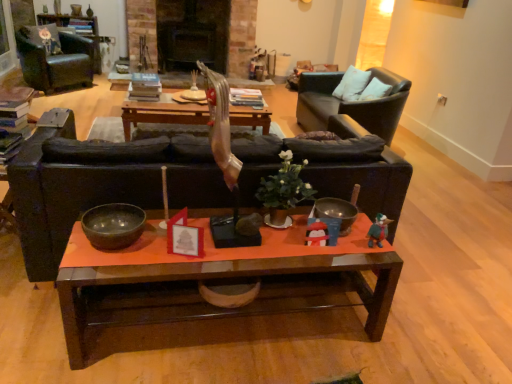
This screenshot has width=512, height=384. What do you see at coordinates (56, 63) in the screenshot?
I see `leather armchair at left, which ranks as the second chair in right-to-left order` at bounding box center [56, 63].

The image size is (512, 384). Describe the element at coordinates (284, 189) in the screenshot. I see `green matte plant at center` at that location.

Locate an element on the screen. shiny dark wood bowl at center, which ranks as the 1th bowl in front-to-back order is located at coordinates (113, 225).

This screenshot has height=384, width=512. I want to click on matte black couch at center, so click(x=100, y=186).

Based on the photo, is wooden coffee table at center, the 2th coffee table from the bottom, wider or thinner than velvet floral pillow at upper left, the first pillow positioned from the top?

wooden coffee table at center, the 2th coffee table from the bottom, is wider than velvet floral pillow at upper left, the first pillow positioned from the top.

From the image's perspective, which object appears higher, wooden coffee table at center, which is the 1th coffee table in top-to-bottom order, or velvet floral pillow at upper left, the 1th pillow viewed from the back?

From the image's view, velvet floral pillow at upper left, the 1th pillow viewed from the back, is above.

Is wooden coffee table at center, the 2th coffee table from the bottom, surrounding velvet floral pillow at upper left, which is the 2th pillow in front-to-back order?

Definitely not — velvet floral pillow at upper left, which is the 2th pillow in front-to-back order, is not inside wooden coffee table at center, the 2th coffee table from the bottom.

Is shiny brown wooden coffee table at center, which appears as the first coffee table when viewed from the front, positioned in front of black leather chair at upper right, which is the second chair from left to right?

That is True.

Can you tell me how much shiny brown wooden coffee table at center, which appears as the 2th coffee table when viewed from the back, and black leather chair at upper right, which is the second chair from left to right, differ in facing direction?

The angular difference between shiny brown wooden coffee table at center, which appears as the 2th coffee table when viewed from the back, and black leather chair at upper right, which is the second chair from left to right, is 90.6 degrees.

Is shiny brown wooden coffee table at center, which is counted as the second coffee table, starting from the top, taller or shorter than black leather chair at upper right, which is the second chair from left to right?

In the image, shiny brown wooden coffee table at center, which is counted as the second coffee table, starting from the top, appears to be shorter than black leather chair at upper right, which is the second chair from left to right.

From the image's perspective, which chair is the 1st one above the shiny brown wooden coffee table at center, which is counted as the second coffee table, starting from the top? Please provide its 2D coordinates.

[(351, 103)]

Considering the sizes of green matte plant at center and wooden coffee table at center, which ranks as the 1th coffee table in back-to-front order, in the image, is green matte plant at center bigger or smaller than wooden coffee table at center, which ranks as the 1th coffee table in back-to-front order,?

green matte plant at center is smaller than wooden coffee table at center, which ranks as the 1th coffee table in back-to-front order.

Is green matte plant at center oriented towards wooden coffee table at center, the 2th coffee table from the bottom?

No, green matte plant at center is not oriented towards wooden coffee table at center, the 2th coffee table from the bottom.

Can you confirm if green matte plant at center is taller than wooden coffee table at center, which is the second coffee table from front to back?

In fact, green matte plant at center may be shorter than wooden coffee table at center, which is the second coffee table from front to back.

From a real-world perspective, between white soft pillow at upper right, the 2th pillow viewed from the left, and shiny dark wood bowl at center, which ranks as the 1th bowl in front-to-back order, who is vertically lower?

From a 3D spatial view, shiny dark wood bowl at center, which ranks as the 1th bowl in front-to-back order, is below.

Is white soft pillow at upper right, the 2th pillow viewed from the top, directly adjacent to shiny dark wood bowl at center, marked as the first bowl in a left-to-right arrangement?

No, white soft pillow at upper right, the 2th pillow viewed from the top, is not beside shiny dark wood bowl at center, marked as the first bowl in a left-to-right arrangement.

From the picture: Is white soft pillow at upper right, the 2th pillow viewed from the top, wider or thinner than shiny dark wood bowl at center, which ranks as the 1th bowl in front-to-back order?

Clearly, white soft pillow at upper right, the 2th pillow viewed from the top, has less width compared to shiny dark wood bowl at center, which ranks as the 1th bowl in front-to-back order.

From a real-world perspective, which bowl is the 1st one underneath the white soft pillow at upper right, which is the second pillow in back-to-front order? Please provide its 2D coordinates.

[(113, 225)]

Are white soft pillow at upper right, marked as the 1th pillow in a bottom-to-top arrangement, and velvet floral pillow at upper left, which ranks as the 2th pillow in bottom-to-top order, beside each other?

white soft pillow at upper right, marked as the 1th pillow in a bottom-to-top arrangement, and velvet floral pillow at upper left, which ranks as the 2th pillow in bottom-to-top order, are clearly separated.

Is white soft pillow at upper right, which is the second pillow in back-to-front order, looking in the opposite direction of velvet floral pillow at upper left, the 1th pillow viewed from the back?

That's not correct — white soft pillow at upper right, which is the second pillow in back-to-front order, is not looking away from velvet floral pillow at upper left, the 1th pillow viewed from the back.

Which of these two, white soft pillow at upper right, which is the second pillow in back-to-front order, or velvet floral pillow at upper left, the 1th pillow viewed from the back, is bigger?

velvet floral pillow at upper left, the 1th pillow viewed from the back, is bigger.

Identify the location of pillow above the white soft pillow at upper right, the 2th pillow viewed from the left (from the image's perspective). The image size is (512, 384). (45, 36).

In terms of width, does leather armchair at left, which ranks as the second chair in right-to-left order, look wider or thinner when compared to plush green duck at right?

Considering their sizes, leather armchair at left, which ranks as the second chair in right-to-left order, looks broader than plush green duck at right.

Locate an element on the screen. toy that is on the right side of leather armchair at left, the first chair viewed from the left is located at coordinates (378, 230).

Considering the relative positions of leather armchair at left, which ranks as the second chair in right-to-left order, and plush green duck at right in the image provided, is leather armchair at left, which ranks as the second chair in right-to-left order, to the right of plush green duck at right from the viewer's perspective?

No, leather armchair at left, which ranks as the second chair in right-to-left order, is not to the right of plush green duck at right.

Between point (27, 61) and point (382, 228), which one is positioned behind?

The point (27, 61) is more distant.

From the image's perspective, is green matte plant at center located above shiny brown wooden coffee table at center, which is counted as the second coffee table, starting from the top?

Yes, from the image's perspective, green matte plant at center is on top of shiny brown wooden coffee table at center, which is counted as the second coffee table, starting from the top.

Which is behind, point (276, 215) or point (119, 287)?

The point (119, 287) is more distant.

In the scene shown: Considering the positions of objects green matte plant at center and shiny brown wooden coffee table at center, positioned as the first coffee table in bottom-to-top order, in the image provided, who is more to the left, green matte plant at center or shiny brown wooden coffee table at center, positioned as the first coffee table in bottom-to-top order,?

From the viewer's perspective, shiny brown wooden coffee table at center, positioned as the first coffee table in bottom-to-top order, appears more on the left side.

Does green matte plant at center have a lesser width compared to shiny brown wooden coffee table at center, which appears as the first coffee table when viewed from the front?

Yes, green matte plant at center is thinner than shiny brown wooden coffee table at center, which appears as the first coffee table when viewed from the front.

This screenshot has height=384, width=512. What are the coordinates of `the 2nd coffee table below the velvet floral pillow at upper left, acting as the first pillow starting from the left (from a real-world perspective)` in the screenshot? It's located at (162, 113).

This screenshot has width=512, height=384. I want to click on the 1st chair above the shiny brown wooden coffee table at center, positioned as the first coffee table in bottom-to-top order (from the image's perspective), so click(x=351, y=103).

Which object lies nearer to the anchor point shiny dark wood bowl at center, placed as the second bowl when sorted from right to left, leather armchair at left, the first chair viewed from the left, or shiny brown wooden coffee table at center, which is counted as the second coffee table, starting from the top?

The object closer to shiny dark wood bowl at center, placed as the second bowl when sorted from right to left, is shiny brown wooden coffee table at center, which is counted as the second coffee table, starting from the top.

From the image, which object appears to be farther from shiny brown wooden coffee table at center, which appears as the first coffee table when viewed from the front, black leather chair at upper right, acting as the first chair starting from the right, or leather armchair at left, which ranks as the second chair in right-to-left order?

leather armchair at left, which ranks as the second chair in right-to-left order, lies further to shiny brown wooden coffee table at center, which appears as the first coffee table when viewed from the front, than the other object.

When comparing their distances from shiny brown wooden coffee table at center, which appears as the 2th coffee table when viewed from the back, does shiny dark wood bowl at center, which is counted as the second bowl, starting from the back, or metallic silver bowl at center, which is counted as the first bowl, starting from the back, seem further?

metallic silver bowl at center, which is counted as the first bowl, starting from the back.

From the image, which object appears to be nearer to shiny dark wood bowl at center, marked as the first bowl in a left-to-right arrangement, black leather chair at upper right, which is the second chair from left to right, or green matte plant at center?

green matte plant at center is positioned closer to the anchor shiny dark wood bowl at center, marked as the first bowl in a left-to-right arrangement.

From the image, which object appears to be nearer to leather armchair at left, the first chair viewed from the left, black leather chair at upper right, which is the second chair from left to right, or plush green duck at right?

black leather chair at upper right, which is the second chair from left to right.

Looking at the image, which one is located further to plush green duck at right, metallic silver bowl at center, the 1th bowl from the right, or black leather chair at upper right, which is the second chair from left to right?

Based on the image, black leather chair at upper right, which is the second chair from left to right, appears to be further to plush green duck at right.

Looking at the image, which one is located further to wooden coffee table at center, which is the second coffee table from front to back, metallic silver bowl at center, the 1th bowl from the right, or black leather chair at upper right, which is the second chair from left to right?

Based on the image, metallic silver bowl at center, the 1th bowl from the right, appears to be further to wooden coffee table at center, which is the second coffee table from front to back.

Based on their spatial positions, is black leather chair at upper right, which is the second chair from left to right, or matte black couch at center closer to green matte plant at center?

Among the two, matte black couch at center is located nearer to green matte plant at center.

This screenshot has height=384, width=512. Identify the location of studio couch between shiny brown wooden coffee table at center, which appears as the 2th coffee table when viewed from the back, and wooden coffee table at center, which is the second coffee table from front to back, along the z-axis. (100, 186).

Find the location of a particular element. chair between velvet floral pillow at upper left, the first pillow positioned from the top, and black leather chair at upper right, acting as the first chair starting from the right, in the horizontal direction is located at coordinates (56, 63).

Locate an element on the screen. Image resolution: width=512 pixels, height=384 pixels. toy between velvet floral pillow at upper left, acting as the first pillow starting from the left, and white soft pillow at upper right, positioned as the 1th pillow in right-to-left order, from left to right is located at coordinates (378, 230).

Where is `plant between shiny brown wooden coffee table at center, positioned as the first coffee table in bottom-to-top order, and wooden coffee table at center, which is the 1th coffee table in top-to-bottom order, along the z-axis`? plant between shiny brown wooden coffee table at center, positioned as the first coffee table in bottom-to-top order, and wooden coffee table at center, which is the 1th coffee table in top-to-bottom order, along the z-axis is located at coordinates (284, 189).